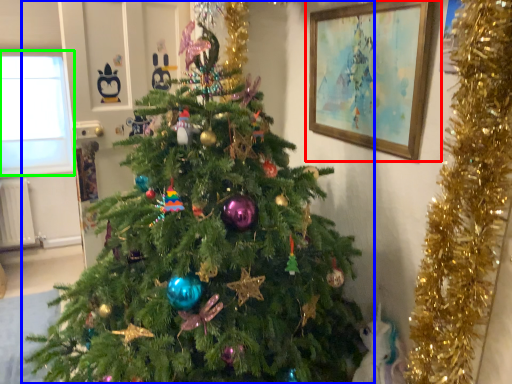
Question: Which object is the closest to the picture frame (highlighted by a red box)? Choose among these: christmas tree (highlighted by a blue box) or window screen (highlighted by a green box).

Choices:
 (A) christmas tree
 (B) window screen

Answer: (A)